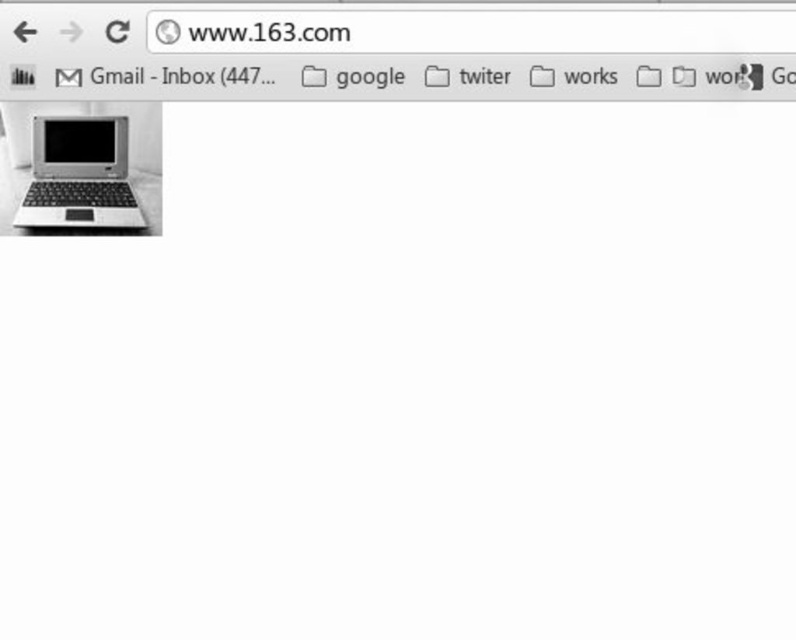
You are navigating a webpage on your computer and see two points marked on the screen. The first point is at coordinate point (14, 225) and the second is at point (98, 118). If you were to draw a straight line from the first point to the second, would the line pass in front of or behind the browser tab labeled Gmail?

The line from point (14, 225) to point (98, 118) would pass in front of the browser tab labeled Gmail because point (14, 225) is in front of point (98, 118).